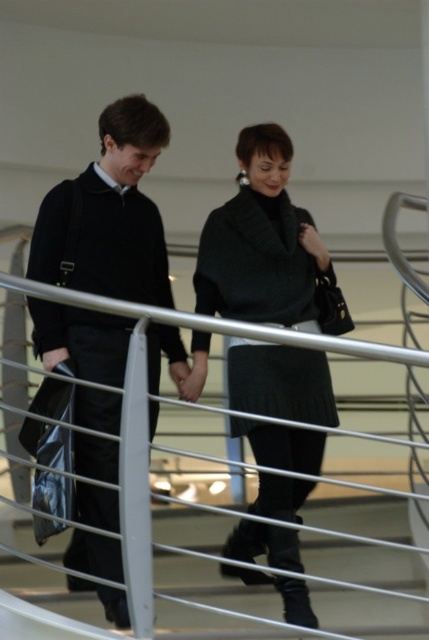
You are an interior designer observing the scene. You notice the matte black sweater at center and the matte black coat at left. Which item would require a larger storage space if you were to store them separately?

The matte black sweater at center is larger in size than the matte black coat at left, so it would require a larger storage space.

You are a security guard in the building. You need to determine if the matte black coat at left can be hung on the white metal railing at center without touching the ground. Based on their sizes, what do you think?

The matte black coat at left is larger in size than the white metal railing at center, so it might not fit properly and could touch the ground if hung there.

You are a fashion designer observing two outfits in the image. The matte black sweater at center and the knitted black dress at center. Which one is positioned to the left?

The matte black sweater at center is positioned to the left of the knitted black dress at center.